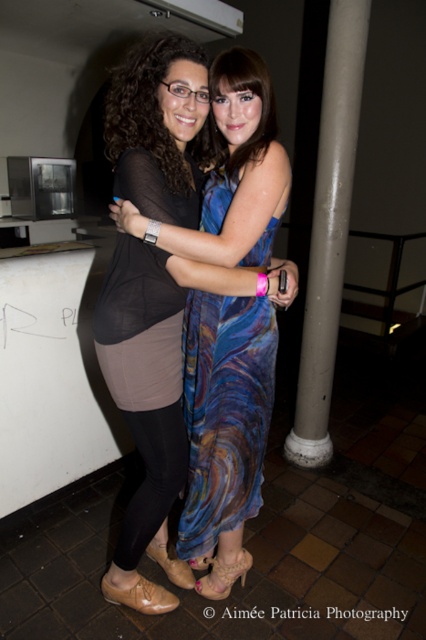
You are a photographer trying to capture a closeup shot of both the matte black top at center and the shiny blue dress at center. Your camera has a 10.5 inch wide lens. Will the two objects fit within the camera lens width?

The matte black top at center and shiny blue dress at center are 5.46 inches apart. Since the distance between them is less than the 10.5 inch lens width, both objects will fit within the camera lens width.